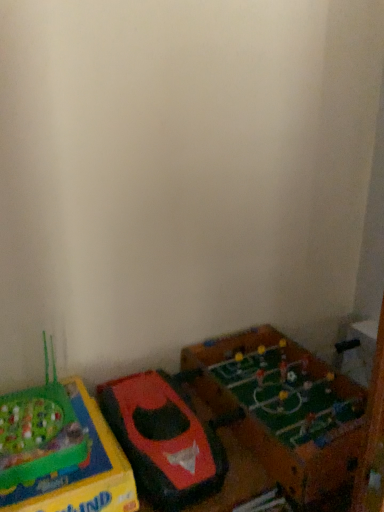
Question: From the image's perspective, is rubberized red toy boat at lower left, acting as the 2th toy starting from the right, beneath green plastic game at lower left, marked as the 1th toy in a left-to-right arrangement?

Choices:
 (A) no
 (B) yes

Answer: (A)

Question: Would you say rubberized red toy boat at lower left, acting as the 2th toy starting from the right, is a long distance from green plastic game at lower left, which appears as the third toy when viewed from the right?

Choices:
 (A) no
 (B) yes

Answer: (A)

Question: From a real-world perspective, is rubberized red toy boat at lower left, acting as the 2th toy starting from the right, positioned under green plastic game at lower left, which appears as the third toy when viewed from the right, based on gravity?

Choices:
 (A) no
 (B) yes

Answer: (A)

Question: Is rubberized red toy boat at lower left, placed as the 2th toy when sorted from left to right, placed right next to green plastic game at lower left, marked as the 1th toy in a left-to-right arrangement?

Choices:
 (A) yes
 (B) no

Answer: (B)

Question: Can you confirm if rubberized red toy boat at lower left, placed as the 2th toy when sorted from left to right, is thinner than green plastic game at lower left, which appears as the third toy when viewed from the right?

Choices:
 (A) no
 (B) yes

Answer: (A)

Question: Is green plastic game at lower left, marked as the 1th toy in a left-to-right arrangement, wider or thinner than green matte foosball table at lower right, the 1th toy in the right-to-left sequence?

Choices:
 (A) wide
 (B) thin

Answer: (B)

Question: Considering the relative positions of green plastic game at lower left, marked as the 1th toy in a left-to-right arrangement, and green matte foosball table at lower right, the 1th toy in the right-to-left sequence, in the image provided, is green plastic game at lower left, marked as the 1th toy in a left-to-right arrangement, to the left or to the right of green matte foosball table at lower right, the 1th toy in the right-to-left sequence,?

Choices:
 (A) right
 (B) left

Answer: (B)

Question: From the image's perspective, is green plastic game at lower left, marked as the 1th toy in a left-to-right arrangement, above or below green matte foosball table at lower right, the 1th toy in the right-to-left sequence?

Choices:
 (A) above
 (B) below

Answer: (B)

Question: Based on their sizes in the image, would you say green plastic game at lower left, marked as the 1th toy in a left-to-right arrangement, is bigger or smaller than green matte foosball table at lower right, the 1th toy in the right-to-left sequence?

Choices:
 (A) small
 (B) big

Answer: (A)

Question: Considering their positions, is rubberized red toy boat at lower left, acting as the 2th toy starting from the right, located in front of or behind green matte foosball table at lower right, which is the third toy in left-to-right order?

Choices:
 (A) behind
 (B) front

Answer: (B)

Question: In terms of size, does rubberized red toy boat at lower left, placed as the 2th toy when sorted from left to right, appear bigger or smaller than green matte foosball table at lower right, which is the third toy in left-to-right order?

Choices:
 (A) big
 (B) small

Answer: (B)

Question: Is point (188, 406) positioned closer to the camera than point (246, 391)?

Choices:
 (A) closer
 (B) farther

Answer: (A)

Question: Considering the relative positions of rubberized red toy boat at lower left, acting as the 2th toy starting from the right, and green matte foosball table at lower right, which is the third toy in left-to-right order, in the image provided, is rubberized red toy boat at lower left, acting as the 2th toy starting from the right, to the left or to the right of green matte foosball table at lower right, which is the third toy in left-to-right order,?

Choices:
 (A) right
 (B) left

Answer: (B)

Question: Considering the positions of point (297, 373) and point (104, 424), is point (297, 373) closer or farther from the camera than point (104, 424)?

Choices:
 (A) closer
 (B) farther

Answer: (B)

Question: Is green matte foosball table at lower right, which is the third toy in left-to-right order, inside the boundaries of green plastic game at lower left, marked as the 1th toy in a left-to-right arrangement, or outside?

Choices:
 (A) inside
 (B) outside

Answer: (B)